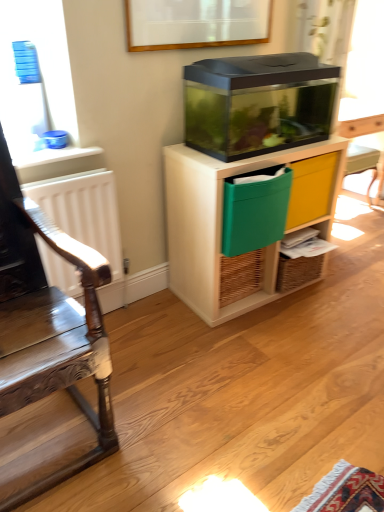
At what (x,y) coordinates should I click in order to perform the action: click on free spot to the right of white matte radiator at left. Please return your answer as a coordinate pair (x, y). Image resolution: width=384 pixels, height=512 pixels. Looking at the image, I should click on (148, 326).